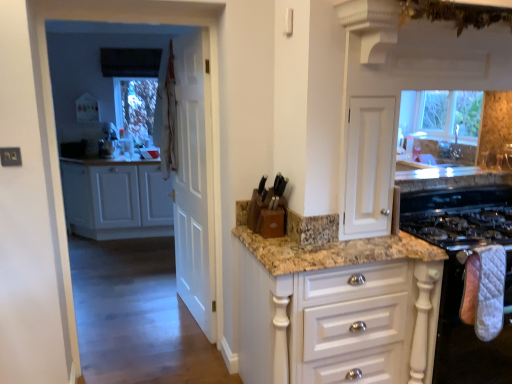
At what (x,y) coordinates should I click in order to perform the action: click on vacant area that is in front of white wooden door at center. Please return your answer as a coordinate pair (x, y). The height and width of the screenshot is (384, 512). Looking at the image, I should click on (162, 340).